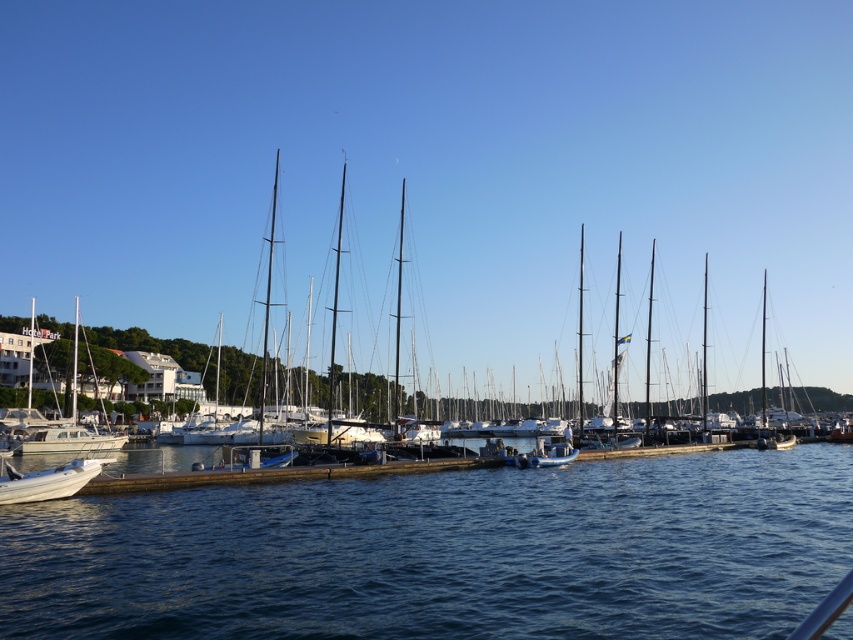
You are standing at the center of the pier and want to locate the white glossy sailboat at left. According to the coordinates provided, in which direction should you look to find it?

The white glossy sailboat at left is located at coordinates 0.695 on the x axis and 0.087 on the y axis. Since you are at the center of the pier, you should look towards the left side of the pier to find the white glossy sailboat at left.

You are standing at the entrance of the marina and want to locate the white matte boat at lower left. According to the coordinates provided, where should you look relative to your current position?

The white matte boat at lower left is located at coordinates point (47,481), which means it is positioned to the right and slightly forward from your current position at the entrance.

You are a visitor standing on the wooden pier and want to board the blue rubber dinghy at center. Which direction should you walk from the white glossy sailboat at left to reach it?

You should walk to the right from the white glossy sailboat at left to reach the blue rubber dinghy at center since the white glossy sailboat at left is positioned to the left of the blue rubber dinghy at center.